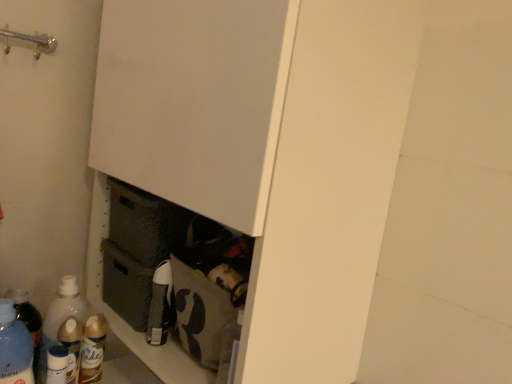
Question: Would you say translucent plastic bottle at lower left, positioned as the first bottle in left-to-right order, is inside or outside white matte cupboard at center?

Choices:
 (A) inside
 (B) outside

Answer: (B)

Question: Looking at their shapes, would you say translucent plastic bottle at lower left, which ranks as the 5th bottle in right-to-left order, is wider or thinner than white matte cupboard at center?

Choices:
 (A) wide
 (B) thin

Answer: (B)

Question: Estimate the real-world distances between objects in this image. Which object is closer to the matte gray cabinet at center?

Choices:
 (A) translucent plastic bottle at lower left, positioned as the second bottle in left-to-right order
 (B) translucent plastic bottle at lower left, which ranks as the 5th bottle in right-to-left order
 (C) brushed metal door handle at upper left
 (D) translucent plastic spray can at lower left, positioned as the 2th bottle in right-to-left order
 (E) matte black bottle at center, the 5th bottle from the left

Answer: (D)

Question: Which is farther from the brushed metal door handle at upper left?

Choices:
 (A) white matte cupboard at center
 (B) translucent plastic bottle at lower left, acting as the 3th bottle starting from the left
 (C) translucent plastic bottle at lower left, which ranks as the 5th bottle in right-to-left order
 (D) translucent plastic spray can at lower left, the 4th bottle when ordered from left to right
 (E) matte black bottle at center, positioned as the first bottle in right-to-left order

Answer: (B)